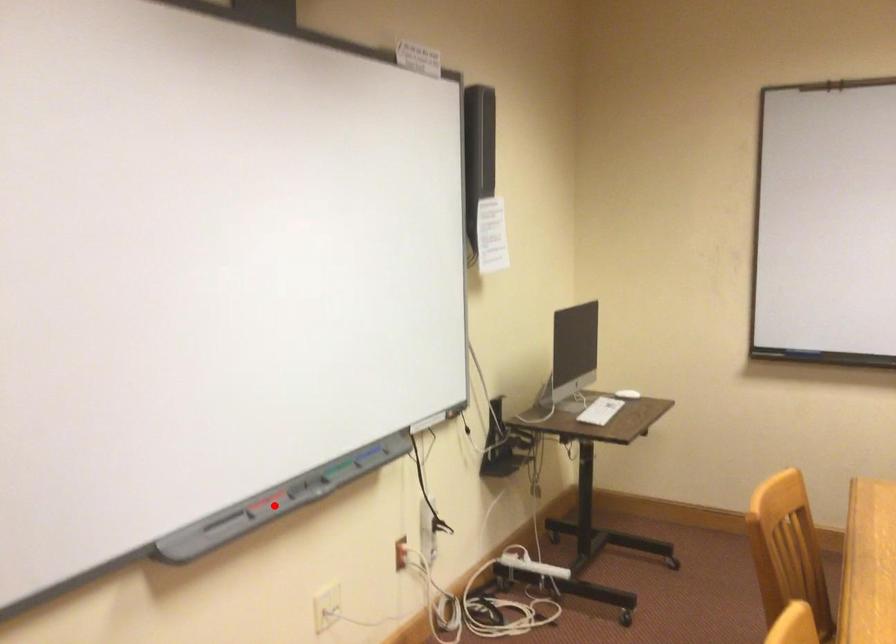
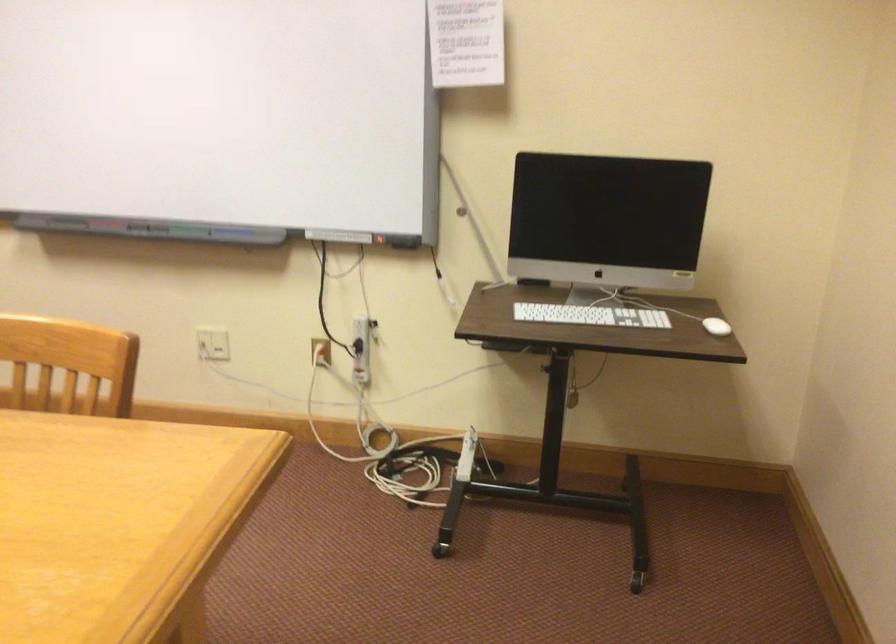
Where in the second image is the point corresponding to the highlighted location from the first image?

(100, 225)